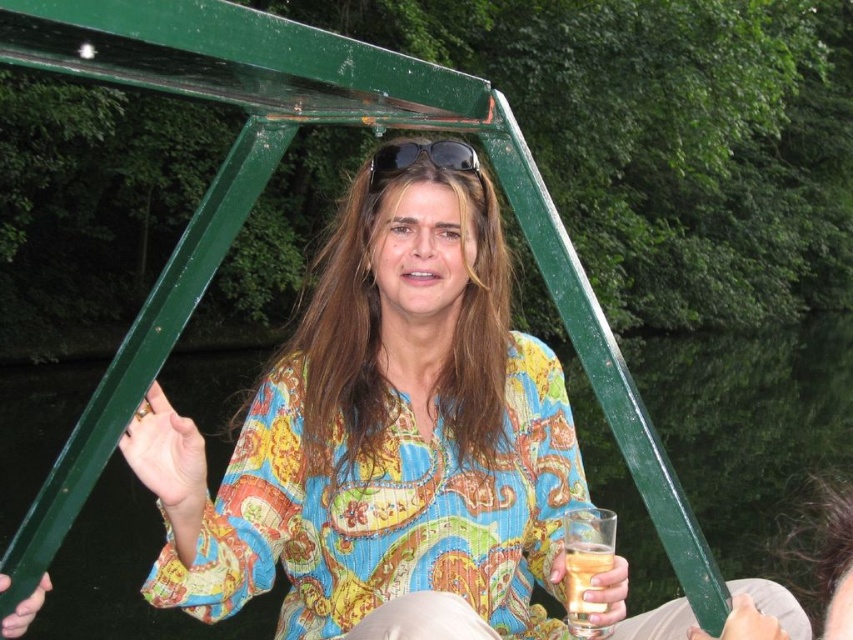
You are a photographer trying to capture the scene of the person sitting under the green metal structure. You need to focus on the transparent glass water at center and the black plastic sunglasses at upper center. Which object should you adjust your camera focus on first if you want to ensure both are in focus, considering their positions?

The transparent glass water at center is below the black plastic sunglasses at upper center. To ensure both are in focus, you should focus on the black plastic sunglasses at upper center first, as it is closer to the camera, and the transparent glass water at center will naturally fall into focus afterward.

You are a bartender preparing drinks for a customer who ordered two beverages. The customer wants to know which glass holds more liquid based on their sizes. Which one should you point to, the transparent glass water at center or the translucent glass at lower center?

The transparent glass water at center holds more liquid because its width surpasses that of the translucent glass at lower center, indicating a larger capacity.